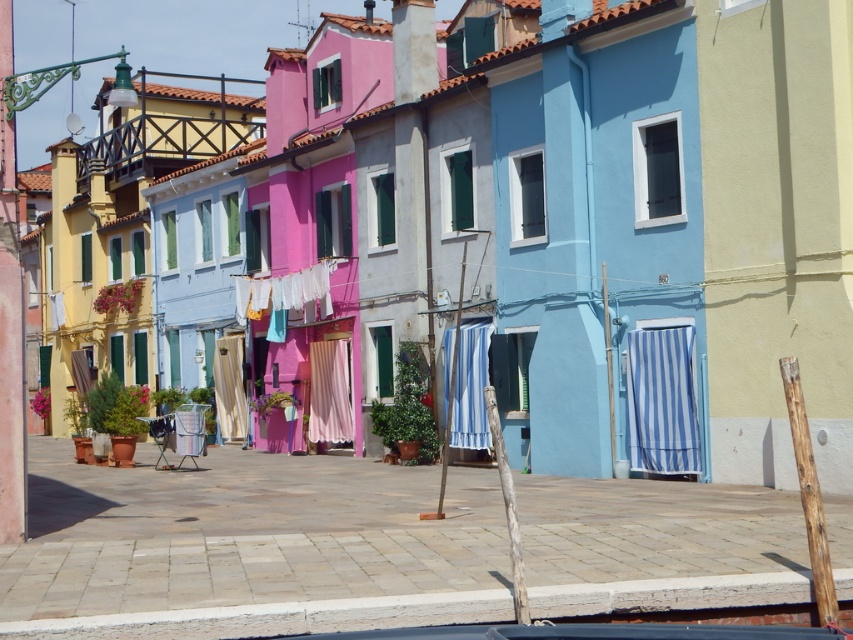
Which is behind, point (457, 356) or point (239, 388)?

Positioned behind is point (239, 388).

Is blue striped fabric at center to the left of matte beige curtain at center from the viewer's perspective?

In fact, blue striped fabric at center is to the right of matte beige curtain at center.

Where is `blue striped fabric at center`? blue striped fabric at center is located at coordinates (471, 387).

The height and width of the screenshot is (640, 853). I want to click on blue striped fabric at center, so click(471, 387).

Does blue striped fabric at lower right have a larger size compared to blue striped fabric at center?

No.

From the picture: Is blue striped fabric at lower right smaller than blue striped fabric at center?

Yes, blue striped fabric at lower right is smaller than blue striped fabric at center.

Locate an element on the screen. blue striped fabric at lower right is located at coordinates (662, 401).

Find the location of a particular element. This screenshot has height=640, width=853. blue striped fabric at lower right is located at coordinates (662, 401).

Is blue striped fabric at center thinner than pink fabric at center?

Yes, blue striped fabric at center is thinner than pink fabric at center.

Is blue striped fabric at center shorter than pink fabric at center?

No, blue striped fabric at center is not shorter than pink fabric at center.

Does point (474, 436) come behind point (312, 396)?

No, (474, 436) is closer to viewer.

At what (x,y) coordinates should I click in order to perform the action: click on blue striped fabric at center. Please return your answer as a coordinate pair (x, y). This screenshot has width=853, height=640. Looking at the image, I should click on (471, 387).